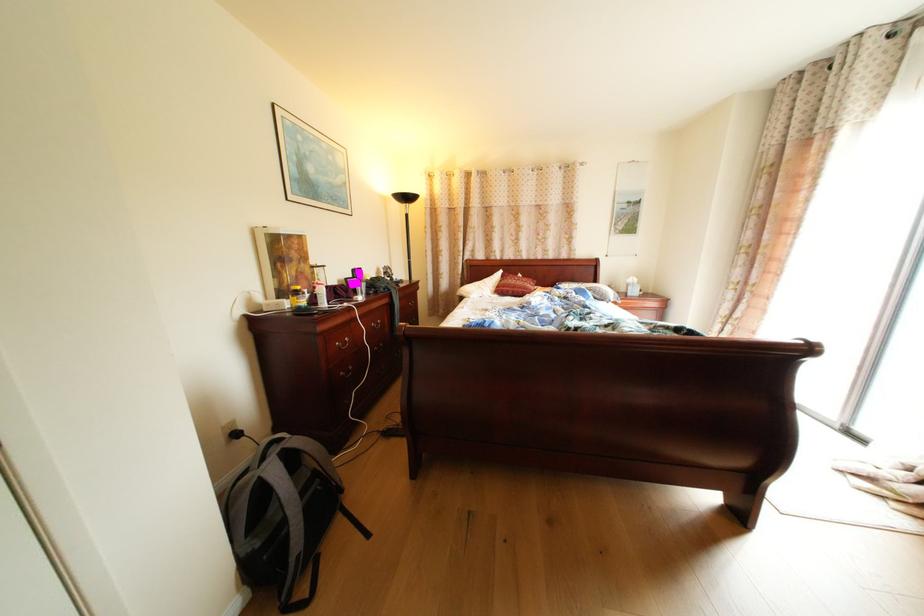
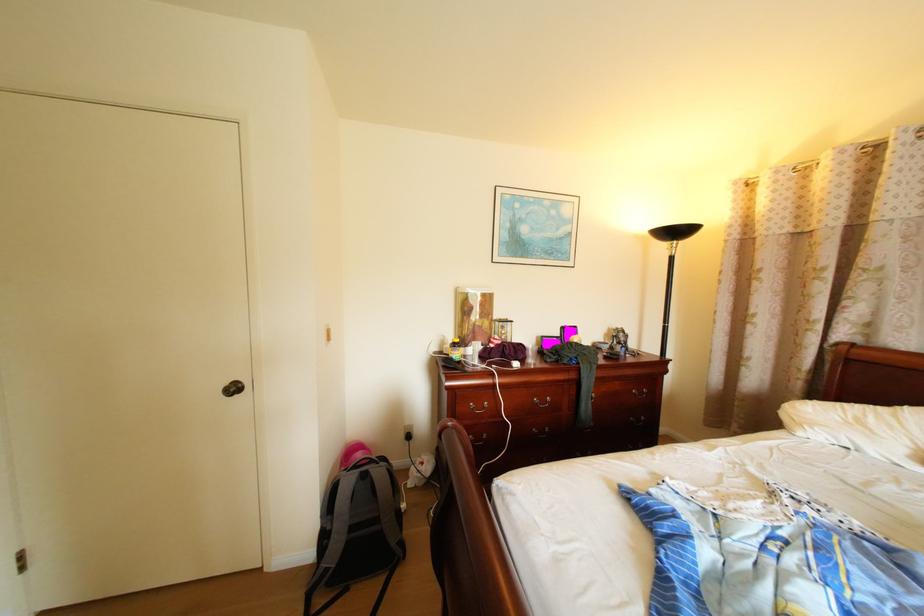
The point at (x=350, y=345) is marked in the first image. Where is the corresponding point in the second image?

(484, 406)